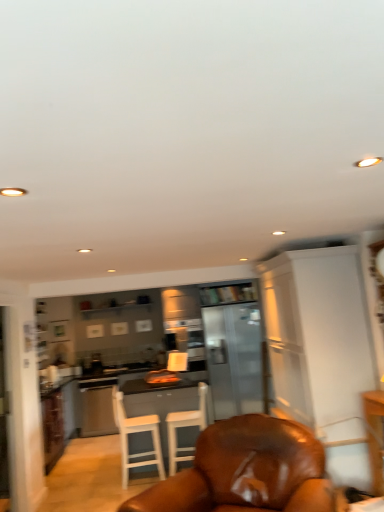
Question: Is wooden bookshelf at center closer to the viewer compared to satin silver dishwasher at center?

Choices:
 (A) yes
 (B) no

Answer: (B)

Question: Is wooden bookshelf at center oriented towards satin silver dishwasher at center?

Choices:
 (A) yes
 (B) no

Answer: (B)

Question: Is wooden bookshelf at center surrounding satin silver dishwasher at center?

Choices:
 (A) no
 (B) yes

Answer: (A)

Question: From a real-world perspective, does wooden bookshelf at center stand above satin silver dishwasher at center?

Choices:
 (A) yes
 (B) no

Answer: (A)

Question: From the image's perspective, is wooden bookshelf at center above satin silver dishwasher at center?

Choices:
 (A) no
 (B) yes

Answer: (B)

Question: Considering the positions of white wood chair at center, the second chair viewed from the front, and white wood table at center in the image, is white wood chair at center, the second chair viewed from the front, bigger or smaller than white wood table at center?

Choices:
 (A) big
 (B) small

Answer: (B)

Question: In terms of height, does white wood chair at center, the second chair viewed from the front, look taller or shorter compared to white wood table at center?

Choices:
 (A) tall
 (B) short

Answer: (A)

Question: From a real-world perspective, is white wood chair at center, acting as the second chair starting from the back, above or below white wood table at center?

Choices:
 (A) below
 (B) above

Answer: (B)

Question: Is point (155, 434) positioned closer to the camera than point (147, 400)?

Choices:
 (A) farther
 (B) closer

Answer: (B)

Question: From their relative heights in the image, would you say wooden bookshelf at center is taller or shorter than white wood chair at center, the second chair viewed from the front?

Choices:
 (A) short
 (B) tall

Answer: (A)

Question: Is wooden bookshelf at center inside or outside of white wood chair at center, acting as the second chair starting from the back?

Choices:
 (A) outside
 (B) inside

Answer: (A)

Question: Is wooden bookshelf at center to the left or to the right of white wood chair at center, the second chair viewed from the front, in the image?

Choices:
 (A) left
 (B) right

Answer: (B)

Question: From a real-world perspective, is wooden bookshelf at center physically located above or below white wood chair at center, acting as the second chair starting from the back?

Choices:
 (A) above
 (B) below

Answer: (A)

Question: Which is correct: satin silver dishwasher at center is inside brown leather chair at center, which is counted as the third chair, starting from the back, or outside of it?

Choices:
 (A) inside
 (B) outside

Answer: (B)

Question: Considering the positions of satin silver dishwasher at center and brown leather chair at center, arranged as the first chair when viewed from the front, in the image, is satin silver dishwasher at center wider or thinner than brown leather chair at center, arranged as the first chair when viewed from the front,?

Choices:
 (A) wide
 (B) thin

Answer: (B)